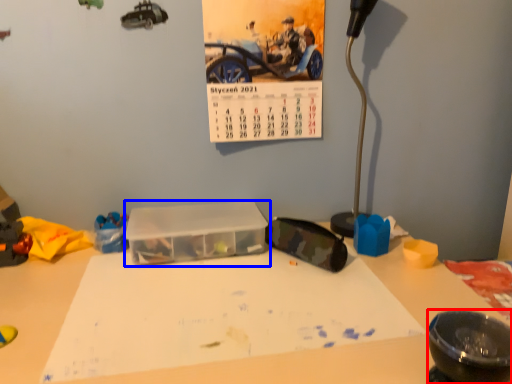
Question: Which point is closer to the camera, bowl (highlighted by a red box) or glass box (highlighted by a blue box)?

Choices:
 (A) bowl
 (B) glass box

Answer: (A)